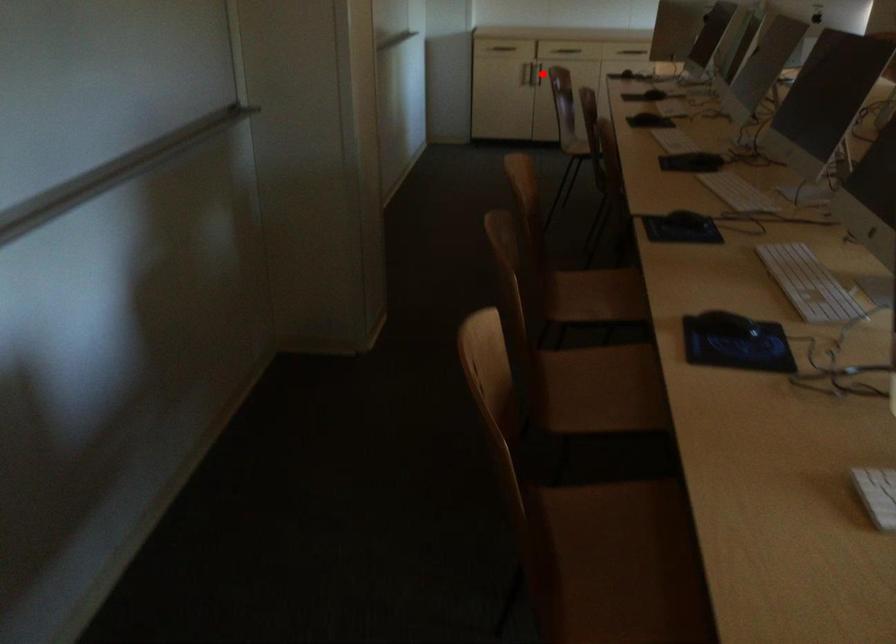
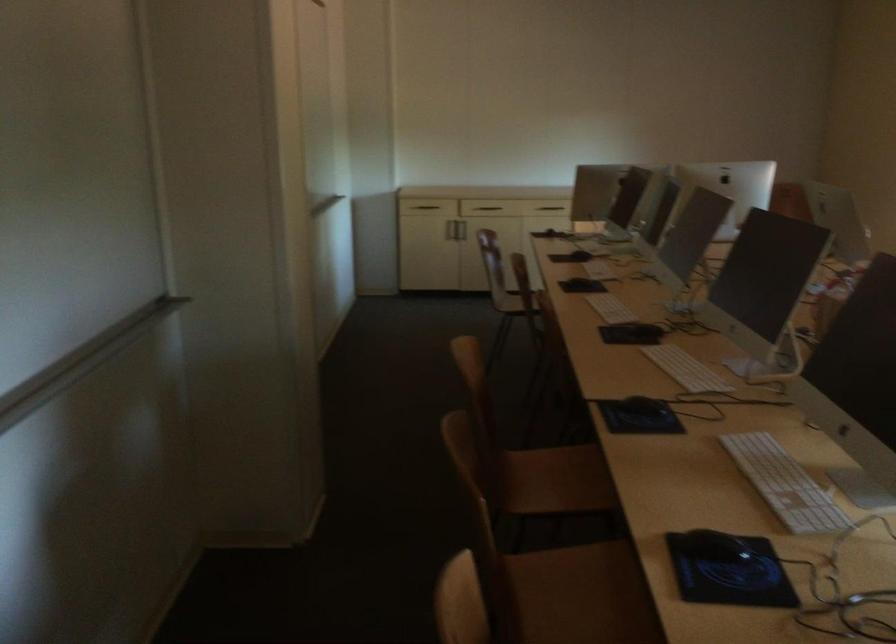
Where in the second image is the point corresponding to the highlighted location from the first image?

(466, 230)